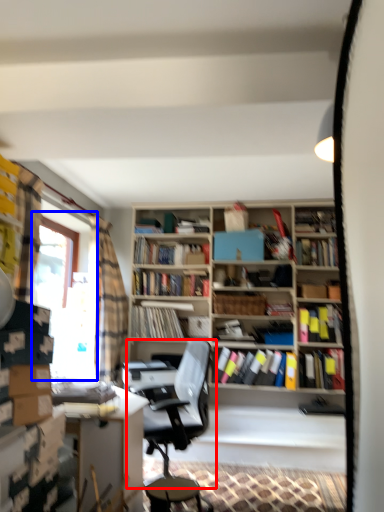
Question: Which object appears closest to the camera in this image, chair (highlighted by a red box) or window screen (highlighted by a blue box)?

Choices:
 (A) chair
 (B) window screen

Answer: (A)